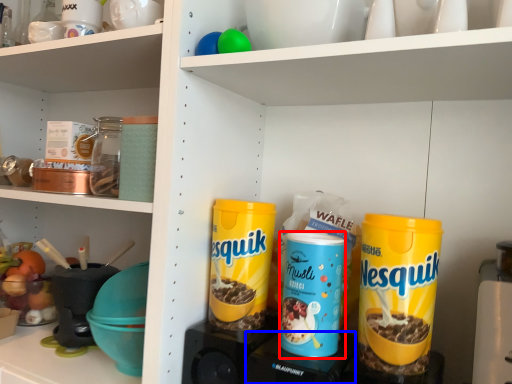
Question: Which point is further to the camera, product (highlighted by a red box) or appliance (highlighted by a blue box)?

Choices:
 (A) product
 (B) appliance

Answer: (A)